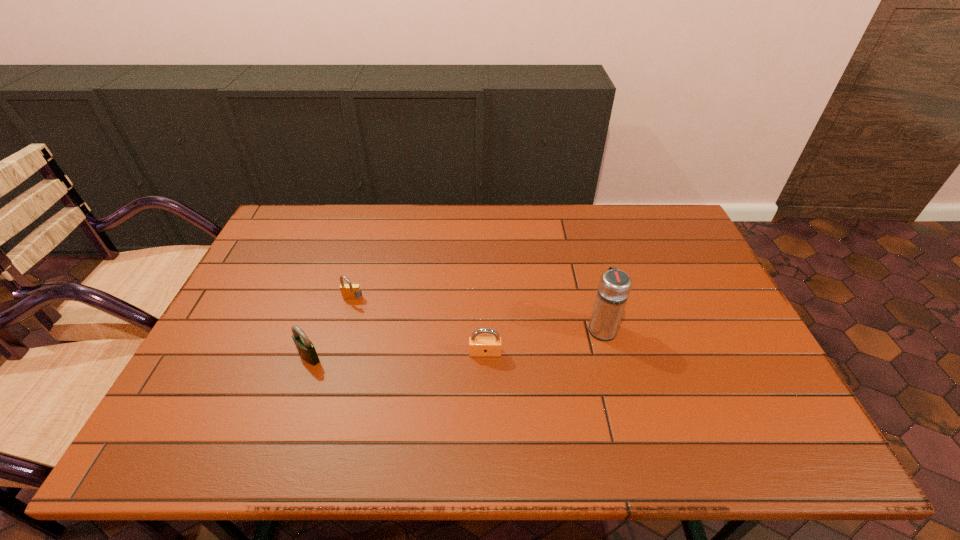
At what (x,y) coordinates should I click in order to perform the action: click on vacant space located on the back of the leftmost object. Please return your answer as a coordinate pair (x, y). The height and width of the screenshot is (540, 960). Looking at the image, I should click on (321, 325).

Find the location of a particular element. vacant space located 0.110m on the side with the combination dials of the farthest object is located at coordinates (343, 334).

Where is `free space located 0.110m to unlock the rightmost padlock from the front`? free space located 0.110m to unlock the rightmost padlock from the front is located at coordinates (486, 395).

Locate an element on the screen. The image size is (960, 540). free space at the far edge of the desktop is located at coordinates (591, 238).

Find the location of `free region at the near edge`. free region at the near edge is located at coordinates (528, 457).

This screenshot has height=540, width=960. Find the location of `free region at the left edge of the desktop`. free region at the left edge of the desktop is located at coordinates (232, 385).

The height and width of the screenshot is (540, 960). I want to click on blank area at the right edge, so click(696, 353).

In the image, there is a desktop. At what (x,y) coordinates should I click in order to perform the action: click on vacant space at the near left corner. Please return your answer as a coordinate pair (x, y). Looking at the image, I should click on (228, 426).

You are a GUI agent. You are given a task and a screenshot of the screen. Output one action in this format:
    pyautogui.click(x=<x>, y=<y>)
    Task: Click on the vacant space at the far right corner of the desktop
    This screenshot has height=540, width=960.
    Given the screenshot: What is the action you would take?
    coord(655,211)

You are a GUI agent. You are given a task and a screenshot of the screen. Output one action in this format:
    pyautogui.click(x=<x>, y=<y>)
    Task: Click on the free spot between the rightmost padlock and the second farthest object
    
    Given the screenshot: What is the action you would take?
    pyautogui.click(x=543, y=340)